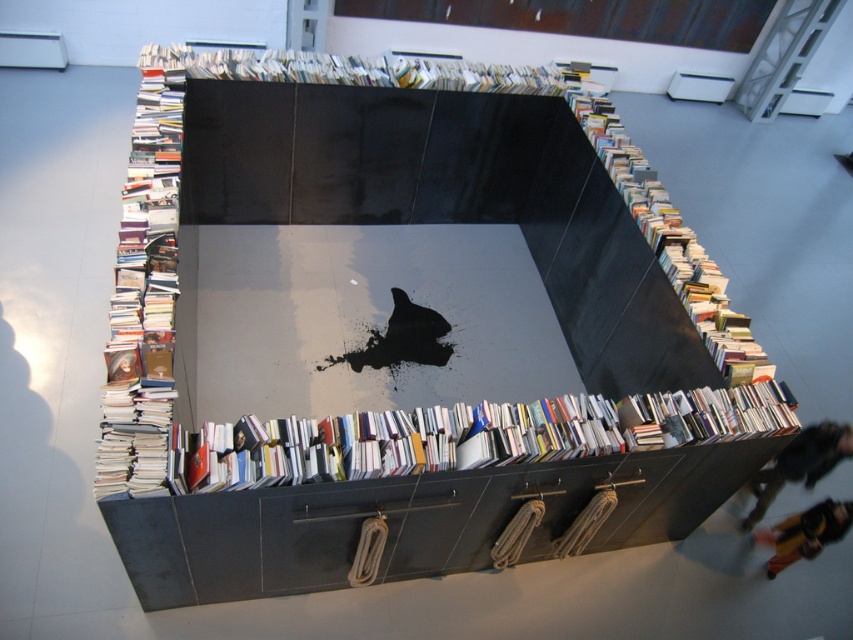
You are an art curator standing in front of the cube structure. You notice two points marked on the cube. The first point is at coordinates point (310, 81) and the second is at point (850, 506). Which of these points is closer to you?

Point (310, 81) is closer to you because it is further to the viewer than point (850, 506).

You are an interior designer planning to place a new sofa in the gallery. The glossy black bookshelf at center and the yellow fabric person at lower right are already present. Considering their sizes, which object should you avoid placing too close to the other to maintain balance?

The glossy black bookshelf at center is larger in size than the yellow fabric person at lower right. To maintain balance, avoid placing the larger glossy black bookshelf at center too close to the smaller yellow fabric person at lower right, as the size difference might create an uneven spatial arrangement.